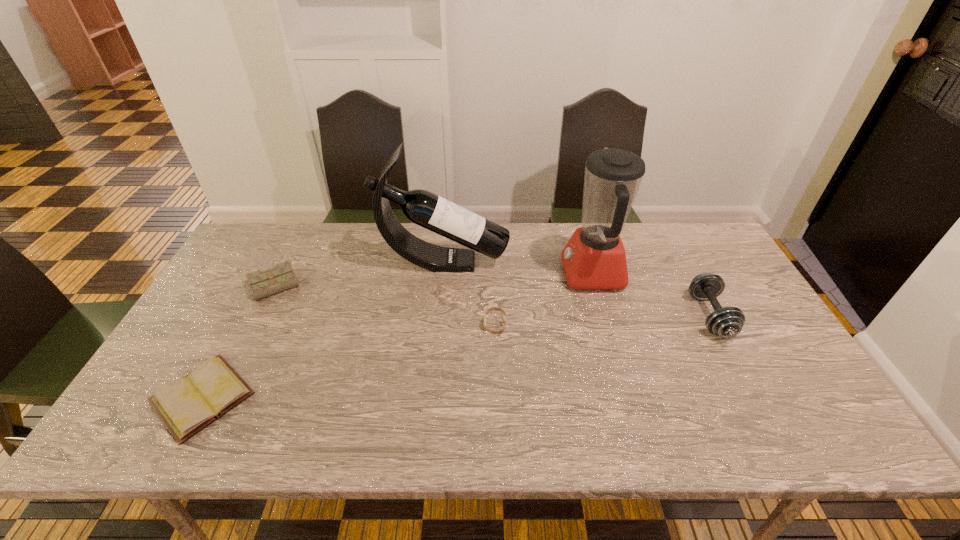
Where is `free space between the farther diary and the wine bottle`? free space between the farther diary and the wine bottle is located at coordinates (361, 274).

Identify the location of free space between the shorter diary and the wine bottle. (323, 329).

Identify the location of free space between the shorter diary and the taller diary. The image size is (960, 540). (240, 341).

The height and width of the screenshot is (540, 960). I want to click on vacant region between the taller diary and the rightmost object, so click(x=494, y=301).

What are the coordinates of `vacant space that's between the watch and the farther diary` in the screenshot? It's located at tap(387, 305).

Where is `free space between the shorter diary and the watch`? free space between the shorter diary and the watch is located at coordinates (348, 361).

I want to click on free space that is in between the nearer diary and the farther diary, so click(240, 341).

Locate an element on the screen. Image resolution: width=960 pixels, height=540 pixels. free space between the third tallest object and the nearest object is located at coordinates (456, 356).

The height and width of the screenshot is (540, 960). I want to click on vacant space that is in between the shorter diary and the wine bottle, so tap(323, 329).

Select which object appears as the fourth closest to the watch. Please provide its 2D coordinates. Your answer should be formatted as a tuple, i.e. [(x, y)], where the tuple contains the x and y coordinates of a point satisfying the conditions above.

[(272, 281)]